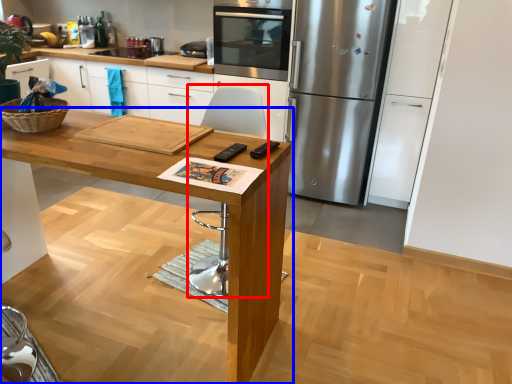
Question: Which object is further to the camera taking this photo, chair (highlighted by a red box) or table (highlighted by a blue box)?

Choices:
 (A) chair
 (B) table

Answer: (A)